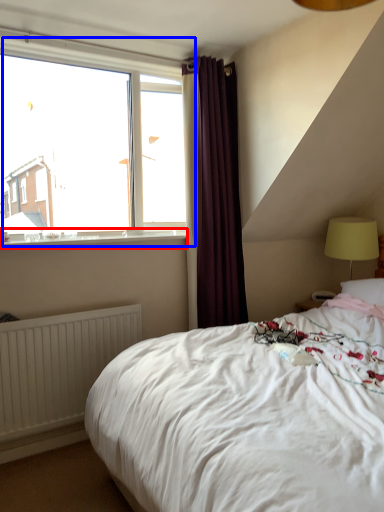
Question: Among these objects, which one is nearest to the camera, window sill (highlighted by a red box) or window (highlighted by a blue box)?

Choices:
 (A) window sill
 (B) window

Answer: (A)